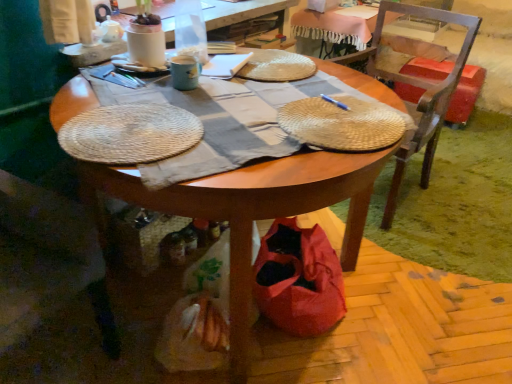
The height and width of the screenshot is (384, 512). What are the coordinates of `vacant area that lies to the right of matte ceramic mug at upper center` in the screenshot? It's located at (230, 82).